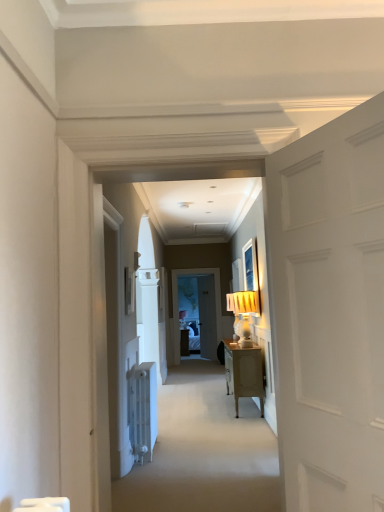
Question: Considering the relative positions of white matte door at right and matte white picture frame at upper left in the image provided, is white matte door at right to the left or to the right of matte white picture frame at upper left?

Choices:
 (A) left
 (B) right

Answer: (B)

Question: Considering the positions of white matte door at right and matte white picture frame at upper left in the image, is white matte door at right wider or thinner than matte white picture frame at upper left?

Choices:
 (A) wide
 (B) thin

Answer: (A)

Question: Considering the real-world distances, which object is closest to the white matte door at right?

Choices:
 (A) matte white picture frame at upper left
 (B) carpet at center

Answer: (B)

Question: Which object is positioned farthest from the white matte door at right?

Choices:
 (A) carpet at center
 (B) matte white picture frame at upper left

Answer: (B)